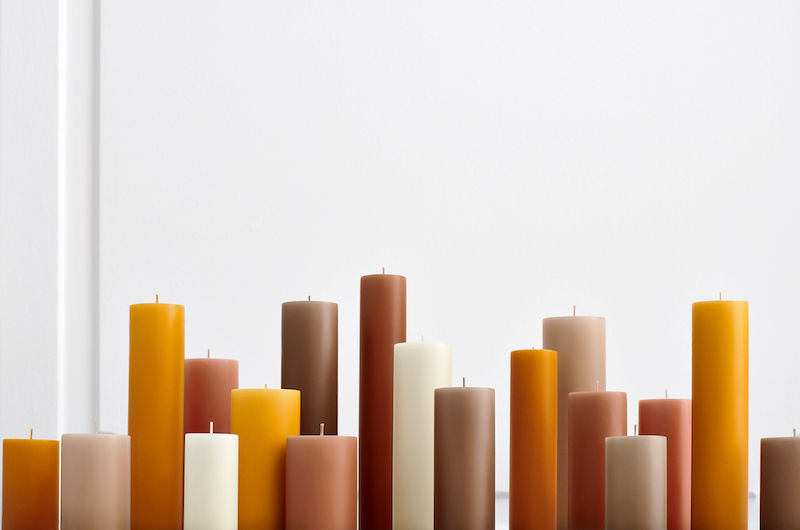
The width and height of the screenshot is (800, 530). Identify the location of brown candle. (780, 464), (646, 480), (568, 333), (446, 428), (308, 344).